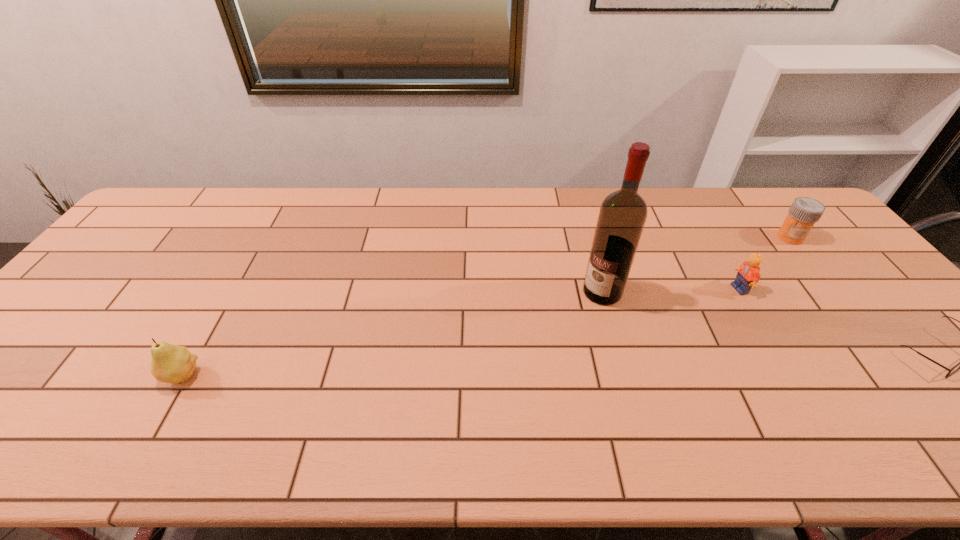
Where is `pear`? pear is located at coordinates (173, 364).

You are a GUI agent. You are given a task and a screenshot of the screen. Output one action in this format:
    pyautogui.click(x=<x>, y=<y>)
    Task: Click on the Lego
    
    Given the screenshot: What is the action you would take?
    pyautogui.click(x=748, y=275)

Where is `medicine`? The image size is (960, 540). medicine is located at coordinates (804, 212).

This screenshot has width=960, height=540. I want to click on the fourth object from right to left, so click(x=622, y=216).

Locate an element on the screen. The width and height of the screenshot is (960, 540). alcohol is located at coordinates pos(622,216).

You are a GUI agent. You are given a task and a screenshot of the screen. Output one action in this format:
    pyautogui.click(x=<x>, y=<y>)
    Task: Click on the vacant space situated 0.360m on the right of the pear
    
    Given the screenshot: What is the action you would take?
    pyautogui.click(x=355, y=376)

You are a GUI agent. You are given a task and a screenshot of the screen. Output one action in this format:
    pyautogui.click(x=<x>, y=<y>)
    Task: Click on the vacant space located on the front-facing side of the Lego
    This screenshot has width=960, height=540.
    Given the screenshot: What is the action you would take?
    pyautogui.click(x=636, y=361)

At what (x,y) coordinates should I click in order to perform the action: click on blank space located 0.340m on the front-facing side of the Lego. Please return your answer as a coordinate pair (x, y). Looking at the image, I should click on coord(653,349).

You are a GUI agent. You are given a task and a screenshot of the screen. Output one action in this format:
    pyautogui.click(x=<x>, y=<y>)
    Task: Click on the vacant space located 0.170m on the front-facing side of the Lego
    
    Given the screenshot: What is the action you would take?
    pyautogui.click(x=697, y=320)

Where is `free location located on the label side of the farthest object`? The width and height of the screenshot is (960, 540). free location located on the label side of the farthest object is located at coordinates (725, 303).